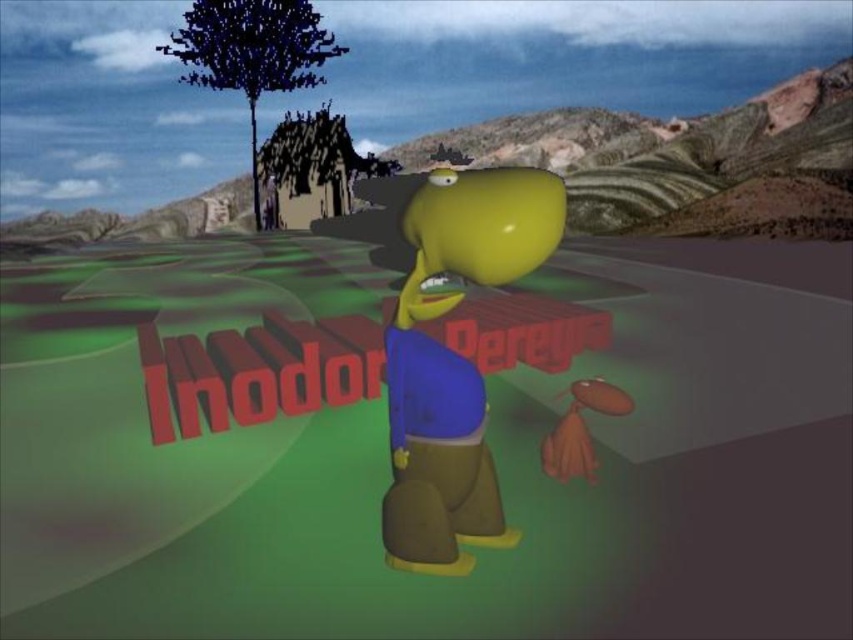
You are an artist trying to draw the scene. You want to ensure the proportions are accurate. Which object, the rubber yellow head at center or the dark green textured tree at upper left, should you draw wider?

The dark green textured tree at upper left should be drawn wider because the rubber yellow head at center has a lesser width compared to dark green textured tree at upper left.

Based on the scene description, where is the rubber yellow head at center in relation to the dark green textured tree at upper left?

The rubber yellow head at center is to the right of the dark green textured tree at upper left.